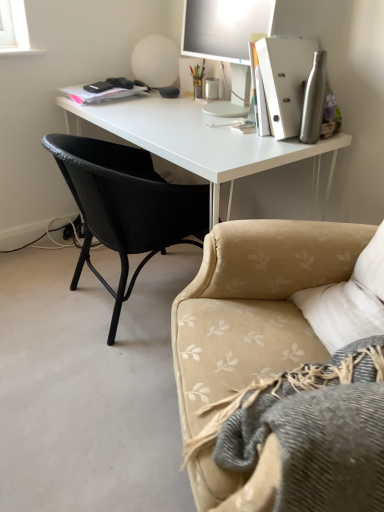
Identify the location of vacant area situated to the left side of black woven chair at left. (34, 288).